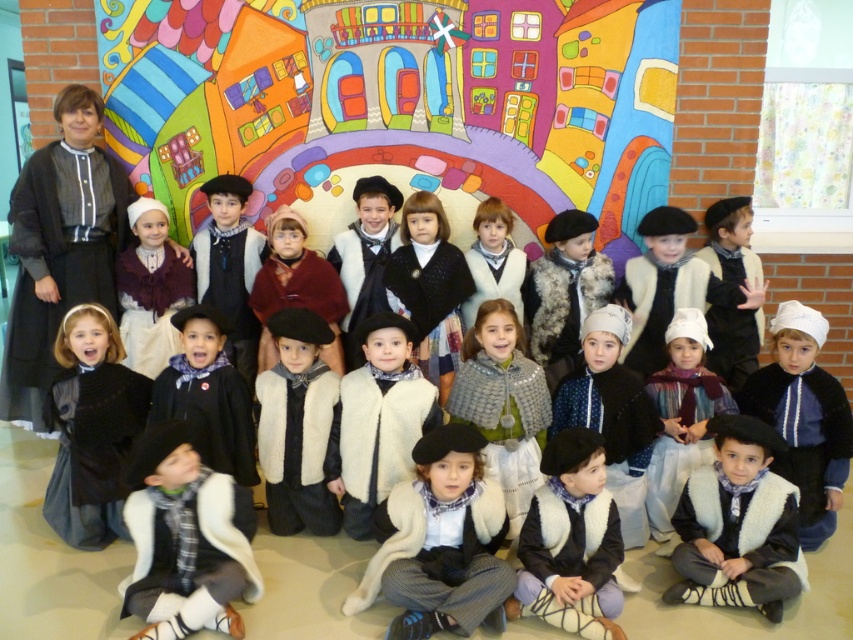
Question: Can you confirm if velvet black hat at center is thinner than matte white dress at center?

Choices:
 (A) no
 (B) yes

Answer: (A)

Question: Based on their relative distances, which object is nearer to the black velvet dress at center?

Choices:
 (A) white woolen vest at center
 (B) white woolen vest at lower left

Answer: (B)

Question: Estimate the real-world distances between objects in this image. Which object is farther from the black velvet dress at center?

Choices:
 (A) white woolen vest at center
 (B) white woolen vest at lower left
 (C) velvet black hat at center
 (D) matte white dress at center

Answer: (C)

Question: Which object is positioned closest to the velvet black hat at center?

Choices:
 (A) matte white dress at center
 (B) white woolen vest at center
 (C) black velvet dress at center
 (D) white woolen vest at lower left

Answer: (B)

Question: Is black velvet dress at center above matte white dress at center?

Choices:
 (A) yes
 (B) no

Answer: (B)

Question: Can you confirm if velvet black hat at center is bigger than matte white dress at center?

Choices:
 (A) no
 (B) yes

Answer: (B)